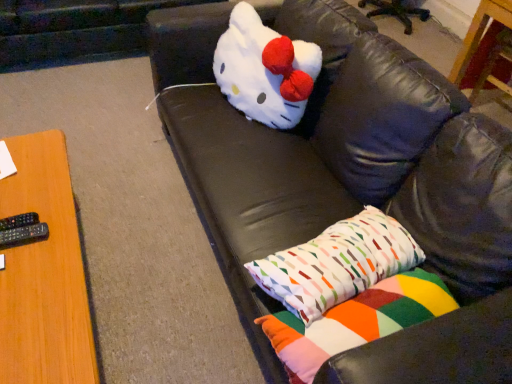
Identify the location of vacant area that is in front of black plastic remote at left, the second remote positioned from the bottom. The width and height of the screenshot is (512, 384). (16, 274).